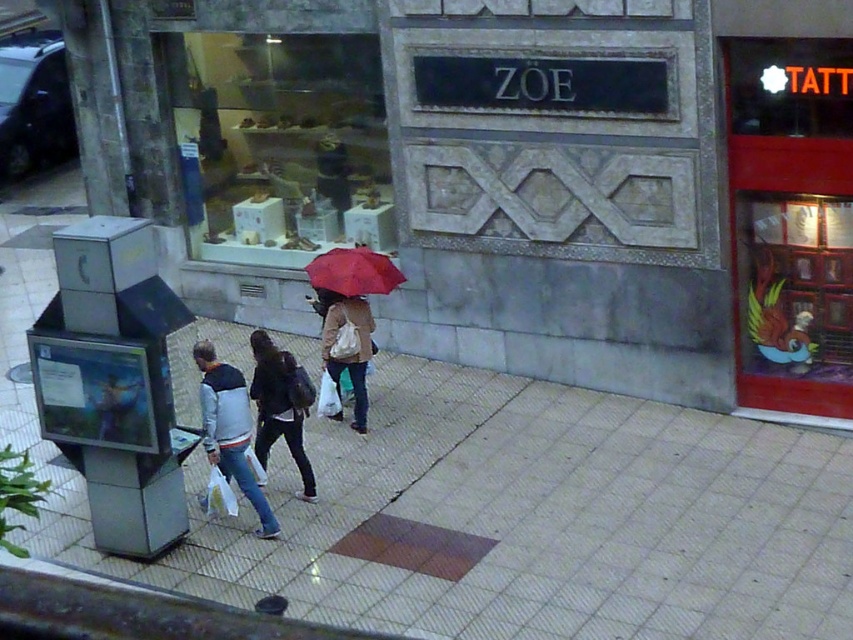
Who is taller, smooth concrete pavement at center or white cotton jacket at center?

With more height is smooth concrete pavement at center.

What do you see at coordinates (483, 500) in the screenshot? This screenshot has height=640, width=853. I see `smooth concrete pavement at center` at bounding box center [483, 500].

Describe the element at coordinates (483, 500) in the screenshot. I see `smooth concrete pavement at center` at that location.

Where is `smooth concrete pavement at center`? The height and width of the screenshot is (640, 853). smooth concrete pavement at center is located at coordinates (483, 500).

Between smooth concrete pavement at center and red matte umbrella at center, which one is positioned higher?

red matte umbrella at center is higher up.

Between smooth concrete pavement at center and red matte umbrella at center, which one is positioned lower?

smooth concrete pavement at center

Describe the element at coordinates (483, 500) in the screenshot. I see `smooth concrete pavement at center` at that location.

I want to click on smooth concrete pavement at center, so click(483, 500).

Who is positioned more to the right, white cotton jacket at center or dark gray fabric jacket at center?

dark gray fabric jacket at center is more to the right.

From the picture: Can you confirm if white cotton jacket at center is thinner than dark gray fabric jacket at center?

No, white cotton jacket at center is not thinner than dark gray fabric jacket at center.

Is point (238, 435) farther from viewer compared to point (253, 342)?

No, it is not.

Identify the location of white cotton jacket at center. This screenshot has width=853, height=640. (229, 428).